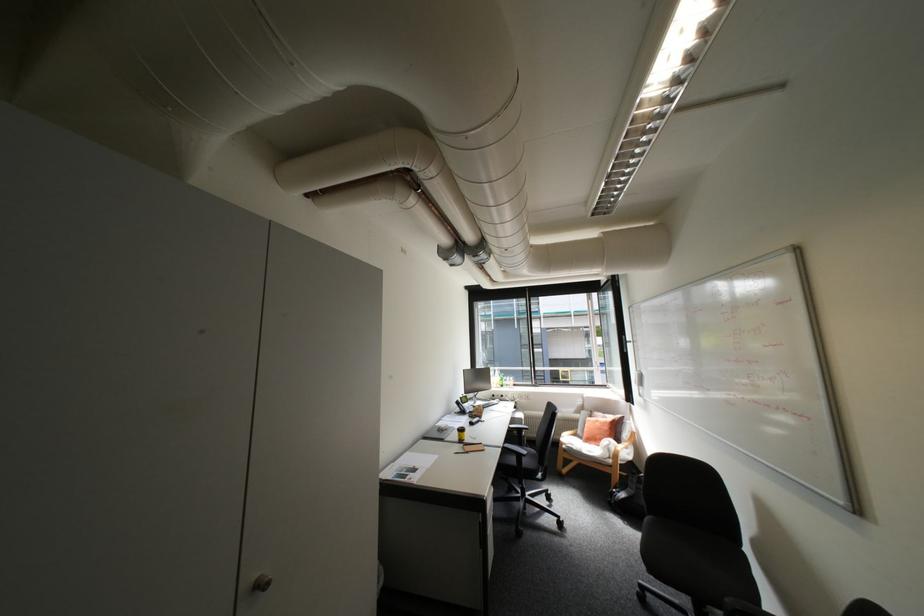
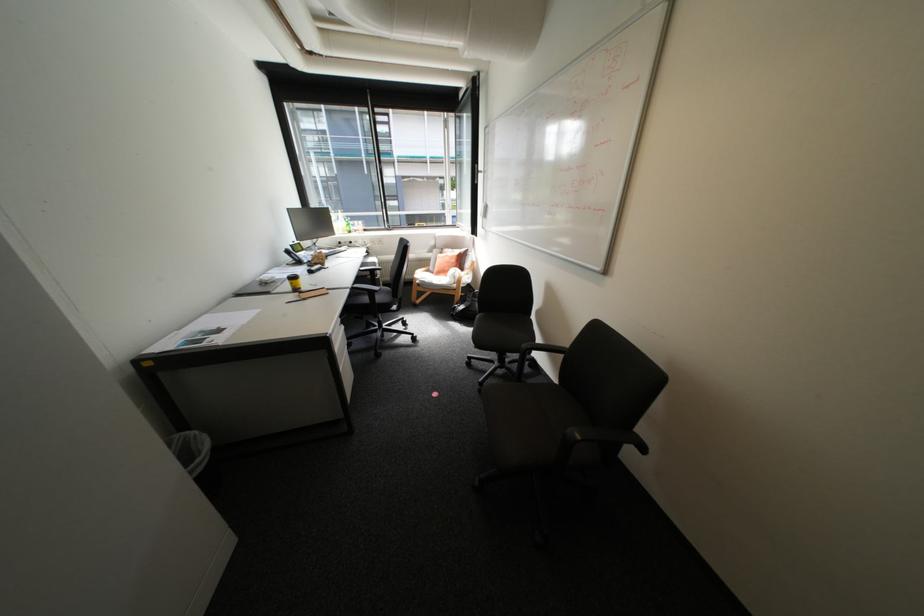
The images are taken continuously from a first-person perspective. In which direction is your viewpoint rotating?

The camera's rotation is toward right-down.